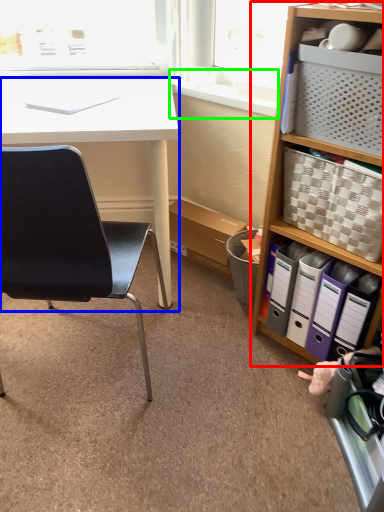
Question: Estimate the real-world distances between objects in this image. Which object is farther from bookcase (highlighted by a red box), desk (highlighted by a blue box) or window sill (highlighted by a green box)?

Choices:
 (A) desk
 (B) window sill

Answer: (A)